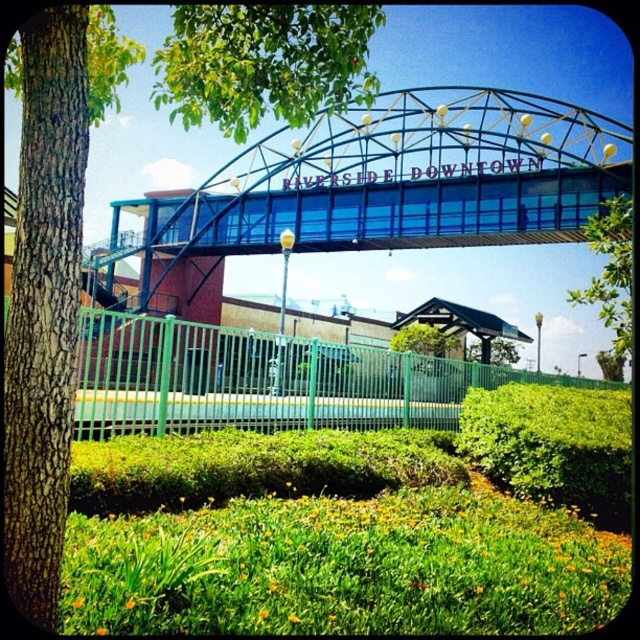
Is blue glass pedestrian bridge at center closer to the viewer compared to green leafy tree at center?

No, blue glass pedestrian bridge at center is behind green leafy tree at center.

You are a GUI agent. You are given a task and a screenshot of the screen. Output one action in this format:
    pyautogui.click(x=<x>, y=<y>)
    Task: Click on the blue glass pedestrian bridge at center
    
    Given the screenshot: What is the action you would take?
    pyautogui.click(x=387, y=186)

Is point (417, 100) more distant than point (616, 317)?

That is True.

Where is `blue glass pedestrian bridge at center`? This screenshot has width=640, height=640. blue glass pedestrian bridge at center is located at coordinates (387, 186).